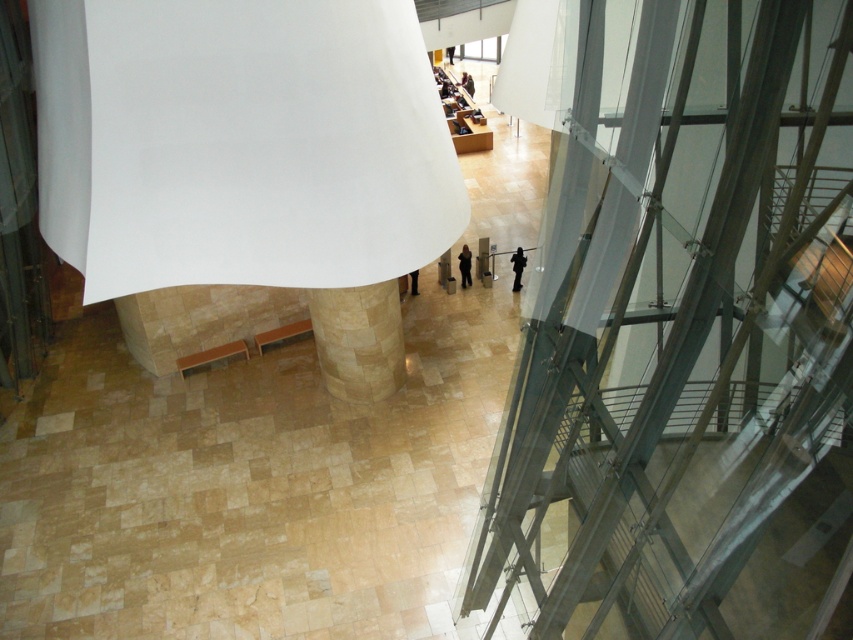
How distant is dark brown leather jacket at center from black leather pants at center?

10.79 meters

Which is more to the right, dark brown leather jacket at center or black leather pants at center?

Positioned to the right is dark brown leather jacket at center.

Is point (465, 72) closer to camera compared to point (416, 273)?

No, (465, 72) is behind (416, 273).

Find the location of a particular element. The width and height of the screenshot is (853, 640). dark brown leather jacket at center is located at coordinates (467, 83).

Is black matte person at center positioned behind black leather pants at center?

No, it is in front of black leather pants at center.

Is black matte person at center smaller than black leather pants at center?

No.

This screenshot has width=853, height=640. Describe the element at coordinates (517, 268) in the screenshot. I see `black matte person at center` at that location.

In order to click on black matte person at center in this screenshot , I will do `click(517, 268)`.

Where is `beige marble pillar at center`? The height and width of the screenshot is (640, 853). beige marble pillar at center is located at coordinates (358, 339).

Who is positioned more to the left, beige marble pillar at center or black matte person at center?

From the viewer's perspective, beige marble pillar at center appears more on the left side.

Is point (352, 296) less distant than point (511, 253)?

Yes, it is in front of point (511, 253).

This screenshot has height=640, width=853. In order to click on beige marble pillar at center in this screenshot , I will do `click(358, 339)`.